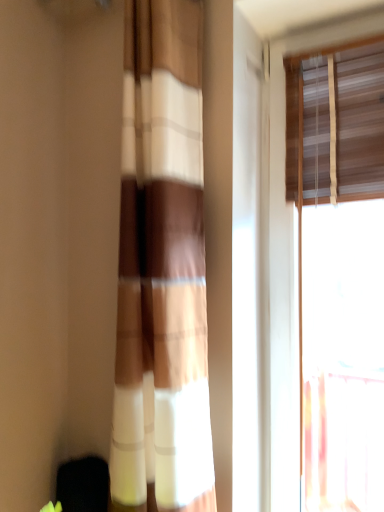
Question: From the image's perspective, is wooden blinds at upper right above or below brown textured curtain at center?

Choices:
 (A) below
 (B) above

Answer: (A)

Question: Looking at the image, does wooden blinds at upper right seem bigger or smaller compared to brown textured curtain at center?

Choices:
 (A) small
 (B) big

Answer: (A)

Question: In the image, is wooden blinds at upper right on the left side or the right side of brown textured curtain at center?

Choices:
 (A) left
 (B) right

Answer: (B)

Question: Considering the positions of brown textured curtain at center and wooden blinds at upper right in the image, is brown textured curtain at center wider or thinner than wooden blinds at upper right?

Choices:
 (A) thin
 (B) wide

Answer: (B)

Question: Is brown textured curtain at center situated inside wooden blinds at upper right or outside?

Choices:
 (A) outside
 (B) inside

Answer: (A)

Question: From a real-world perspective, is brown textured curtain at center physically located above or below wooden blinds at upper right?

Choices:
 (A) below
 (B) above

Answer: (B)

Question: In terms of height, does brown textured curtain at center look taller or shorter compared to wooden blinds at upper right?

Choices:
 (A) tall
 (B) short

Answer: (B)